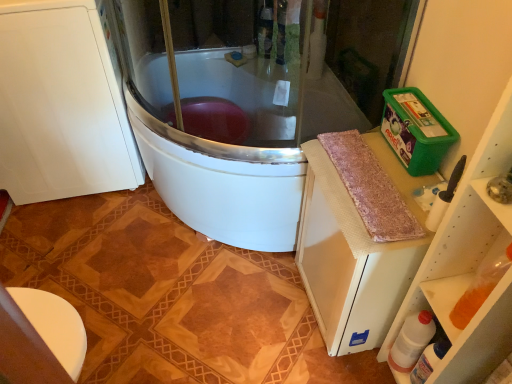
Question: Is pink shaggy rug at right located outside green plastic container at upper right?

Choices:
 (A) yes
 (B) no

Answer: (A)

Question: Could green plastic container at upper right be considered to be inside pink shaggy rug at right?

Choices:
 (A) no
 (B) yes

Answer: (A)

Question: Is the position of pink shaggy rug at right less distant than that of green plastic container at upper right?

Choices:
 (A) no
 (B) yes

Answer: (A)

Question: Is pink shaggy rug at right next to green plastic container at upper right and touching it?

Choices:
 (A) yes
 (B) no

Answer: (B)

Question: Does pink shaggy rug at right appear on the right side of green plastic container at upper right?

Choices:
 (A) no
 (B) yes

Answer: (B)

Question: Is pink shaggy rug at right bigger than green plastic container at upper right?

Choices:
 (A) no
 (B) yes

Answer: (A)

Question: Is green plastic container at upper right to the left of pink shaggy rug at right from the viewer's perspective?

Choices:
 (A) no
 (B) yes

Answer: (B)

Question: Is green plastic container at upper right facing away from pink shaggy rug at right?

Choices:
 (A) no
 (B) yes

Answer: (A)

Question: Does green plastic container at upper right have a greater height compared to pink shaggy rug at right?

Choices:
 (A) yes
 (B) no

Answer: (A)

Question: From the image's perspective, is green plastic container at upper right over pink shaggy rug at right?

Choices:
 (A) yes
 (B) no

Answer: (B)

Question: Is green plastic container at upper right positioned in front of pink shaggy rug at right?

Choices:
 (A) no
 (B) yes

Answer: (B)

Question: Is green plastic container at upper right not within pink shaggy rug at right?

Choices:
 (A) yes
 (B) no

Answer: (A)

Question: Would you say white plastic bottle at lower right, placed as the 2th bottle when sorted from left to right, contains green plastic container at upper right?

Choices:
 (A) no
 (B) yes

Answer: (A)